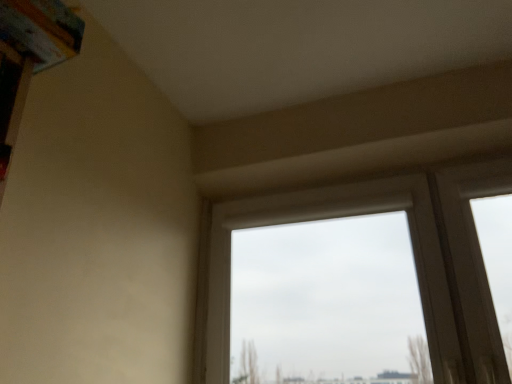
The height and width of the screenshot is (384, 512). Describe the element at coordinates (414, 258) in the screenshot. I see `transparent glass window at upper center` at that location.

Measure the distance between transparent glass window at upper center and camera.

transparent glass window at upper center is 1.24 meters from camera.

This screenshot has height=384, width=512. What are the coordinates of `transparent glass window at upper center` in the screenshot? It's located at (414, 258).

What are the coordinates of `transparent glass window at upper center` in the screenshot? It's located at (414, 258).